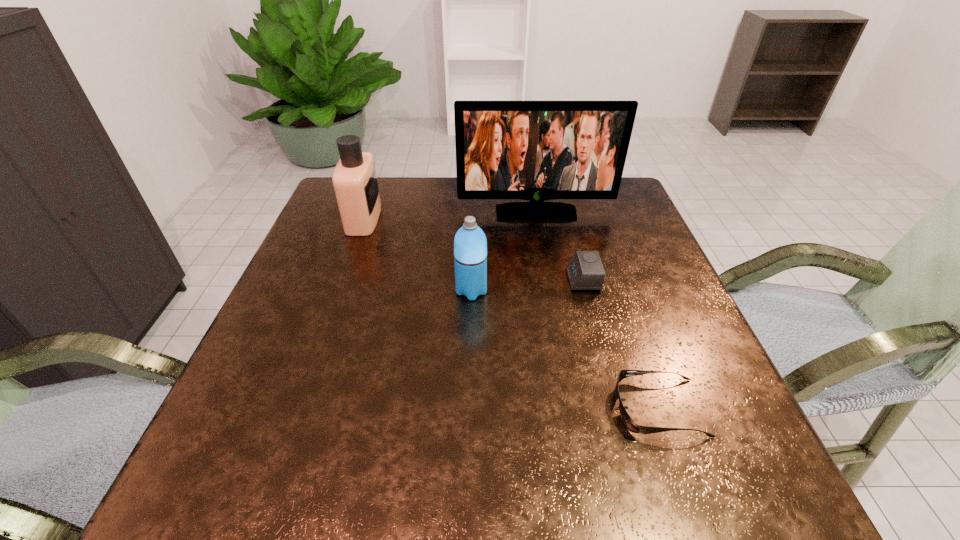
This screenshot has height=540, width=960. What are the coordinates of `free space located 0.330m on the front-facing side of the second shortest object` in the screenshot? It's located at [418, 279].

You are a GUI agent. You are given a task and a screenshot of the screen. Output one action in this format:
    pyautogui.click(x=<x>, y=<y>)
    Task: Click on the free space located on the front-facing side of the second shortest object
    The height and width of the screenshot is (540, 960).
    Given the screenshot: What is the action you would take?
    pyautogui.click(x=537, y=279)

Image resolution: width=960 pixels, height=540 pixels. I want to click on free space located on the front-facing side of the second shortest object, so click(414, 279).

Find the location of a particular element. The height and width of the screenshot is (540, 960). vacant space located on the front-facing side of the nearest object is located at coordinates (392, 408).

What are the coordinates of `vacant region located on the front-facing side of the nearest object` in the screenshot? It's located at (489, 408).

At what (x,y) coordinates should I click in order to perform the action: click on free region located on the front-facing side of the nearest object. Please return your answer as a coordinate pair (x, y). Looking at the image, I should click on (586, 408).

Where is `monitor that is positioned at the far edge`? The height and width of the screenshot is (540, 960). monitor that is positioned at the far edge is located at coordinates (530, 150).

This screenshot has height=540, width=960. Find the location of `perfume located at the far edge`. perfume located at the far edge is located at coordinates [x=355, y=183].

Image resolution: width=960 pixels, height=540 pixels. Find the location of `object situated at the left edge`. object situated at the left edge is located at coordinates (355, 183).

Where is `monitor that is at the right edge`? monitor that is at the right edge is located at coordinates (530, 150).